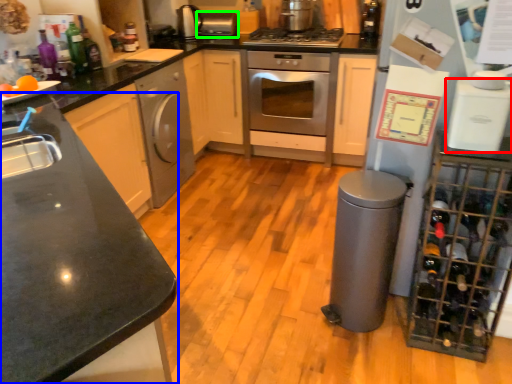
Question: Which object is the closest to the kitchen appliance (highlighted by a red box)? Choose among these: countertop (highlighted by a blue box) or appliance (highlighted by a green box).

Choices:
 (A) countertop
 (B) appliance

Answer: (A)